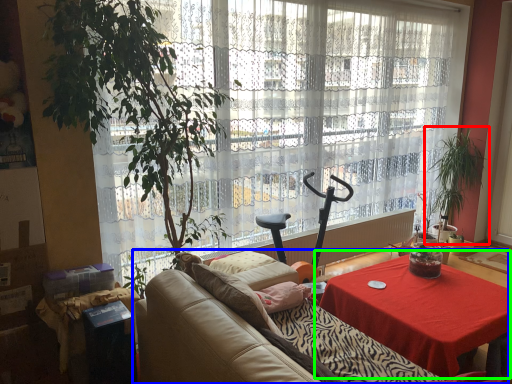
Question: Which is nearer to the houseplant (highlighted by a red box)? studio couch (highlighted by a blue box) or table (highlighted by a green box).

Choices:
 (A) studio couch
 (B) table

Answer: (B)